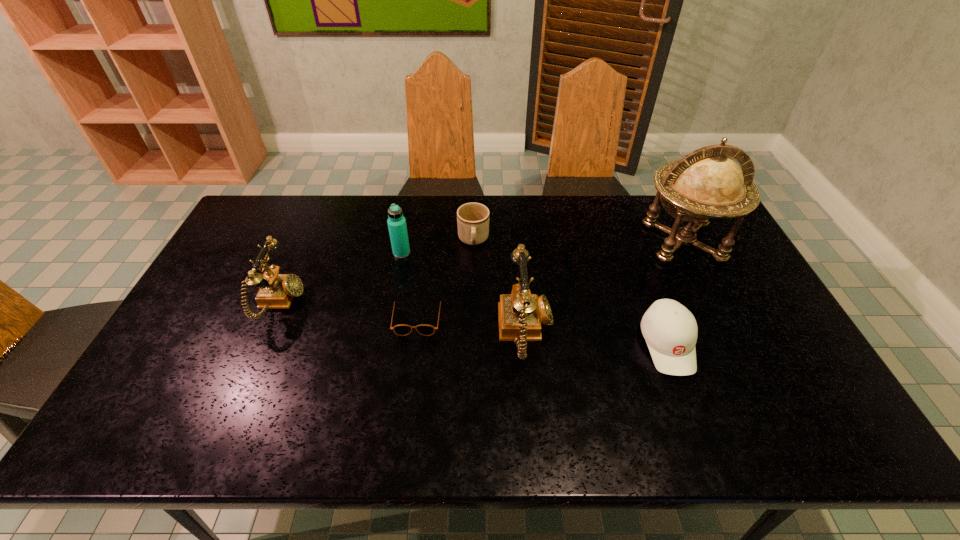
Where is `free point located 0.160m on the dial number of the taller telephone`? free point located 0.160m on the dial number of the taller telephone is located at coordinates (612, 332).

In order to click on vacant area situated on the left of the water bottle in this screenshot , I will do `click(347, 253)`.

You are a GUI agent. You are given a task and a screenshot of the screen. Output one action in this format:
    pyautogui.click(x=<x>, y=<y>)
    Task: Click on the free point located 0.280m on the side of the mug with the handle
    This screenshot has width=960, height=540.
    Given the screenshot: What is the action you would take?
    pyautogui.click(x=472, y=322)

Where is `free space located 0.310m on the front-facing side of the tallest object`? The image size is (960, 540). free space located 0.310m on the front-facing side of the tallest object is located at coordinates (740, 355).

Locate an element on the screen. free space located on the front-facing side of the sunglasses is located at coordinates (411, 368).

Locate an element on the screen. free spot located on the front-facing side of the baseball cap is located at coordinates (686, 396).

You are a GUI agent. You are given a task and a screenshot of the screen. Output one action in this format:
    pyautogui.click(x=<x>, y=<y>)
    Task: Click on the mug that is at the far edge
    The height and width of the screenshot is (540, 960).
    Given the screenshot: What is the action you would take?
    click(x=472, y=218)

You are a GUI agent. You are given a task and a screenshot of the screen. Output one action in this format:
    pyautogui.click(x=<x>, y=<y>)
    Task: Click on the globe at the far edge
    The width and height of the screenshot is (960, 540).
    Given the screenshot: What is the action you would take?
    pyautogui.click(x=706, y=183)

Identify the location of telephone that is at the near edge. The height and width of the screenshot is (540, 960). (520, 314).

Locate an element on the screen. This screenshot has width=960, height=540. baseball cap present at the near edge is located at coordinates (670, 330).